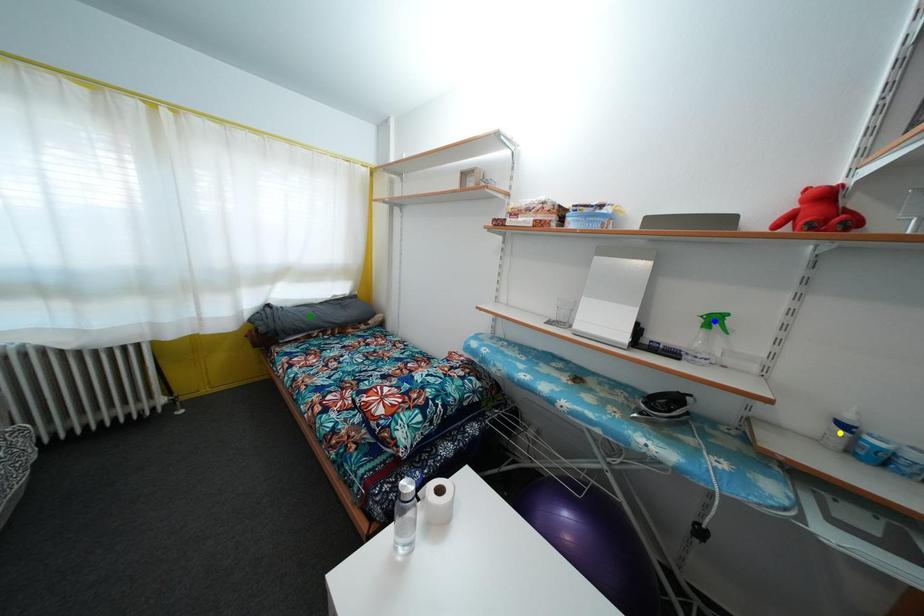
Order these from nearest to farthest:
1. yellow point
2. green point
3. blue point

green point, blue point, yellow point